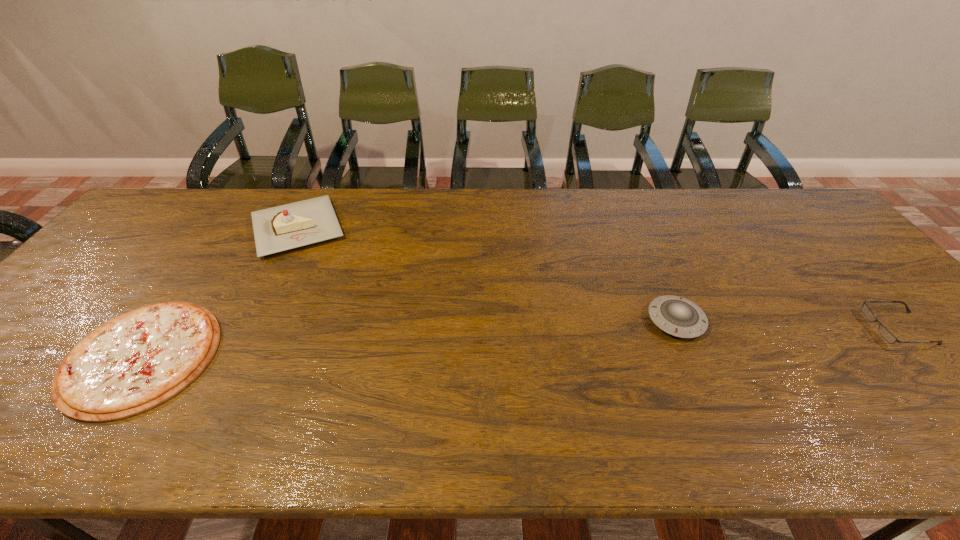
In order to click on the farthest object in this screenshot , I will do `click(293, 225)`.

The image size is (960, 540). Find the location of `the tallest object`. the tallest object is located at coordinates (293, 225).

Where is `the second object from right to left`? the second object from right to left is located at coordinates (677, 316).

Where is `saucer`? Image resolution: width=960 pixels, height=540 pixels. saucer is located at coordinates (677, 316).

What are the coordinates of `the third tallest object` in the screenshot? It's located at (884, 332).

Where is `spectacles`? spectacles is located at coordinates pos(884,332).

The image size is (960, 540). I want to click on the shortest object, so click(x=136, y=361).

Locate an element on the screen. vacant position located 0.160m on the left of the farthest object is located at coordinates (195, 228).

The width and height of the screenshot is (960, 540). What are the coordinates of `free space located 0.300m on the back of the second tallest object` in the screenshot? It's located at (637, 231).

The image size is (960, 540). Identify the location of free space located on the front-facing side of the rightmost object. (835, 328).